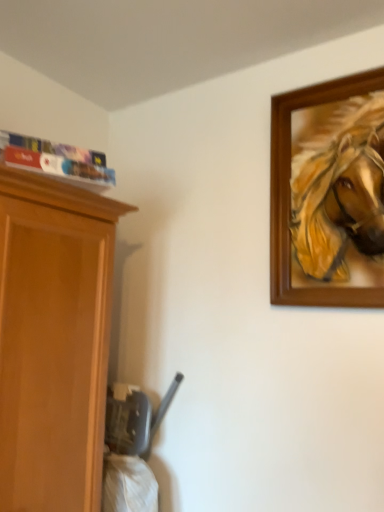
Identify the location of golden textured painting of horse at upper right. This screenshot has width=384, height=512. (339, 192).

The width and height of the screenshot is (384, 512). Describe the element at coordinates (339, 192) in the screenshot. I see `golden textured painting of horse at upper right` at that location.

Where is `golden textured painting of horse at upper right`? golden textured painting of horse at upper right is located at coordinates (339, 192).